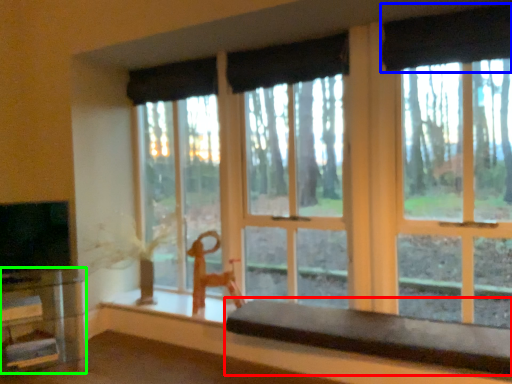
Question: Based on their relative distances, which object is farther from table (highlighted by a red box)? Choose from curtain (highlighted by a blue box) and table (highlighted by a green box).

Choices:
 (A) curtain
 (B) table

Answer: (A)